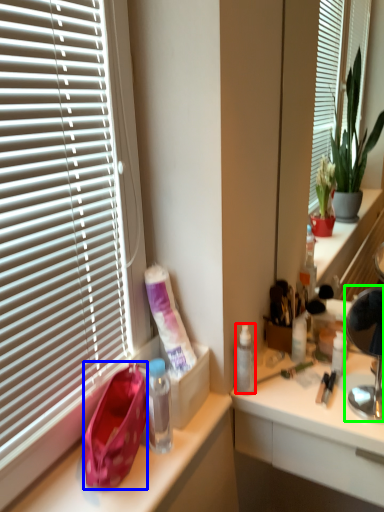
Question: Considering the real-world distances, which object is farthest from bottle (highlighted by a red box)? handbag (highlighted by a blue box) or lamp (highlighted by a green box)?

Choices:
 (A) handbag
 (B) lamp

Answer: (A)